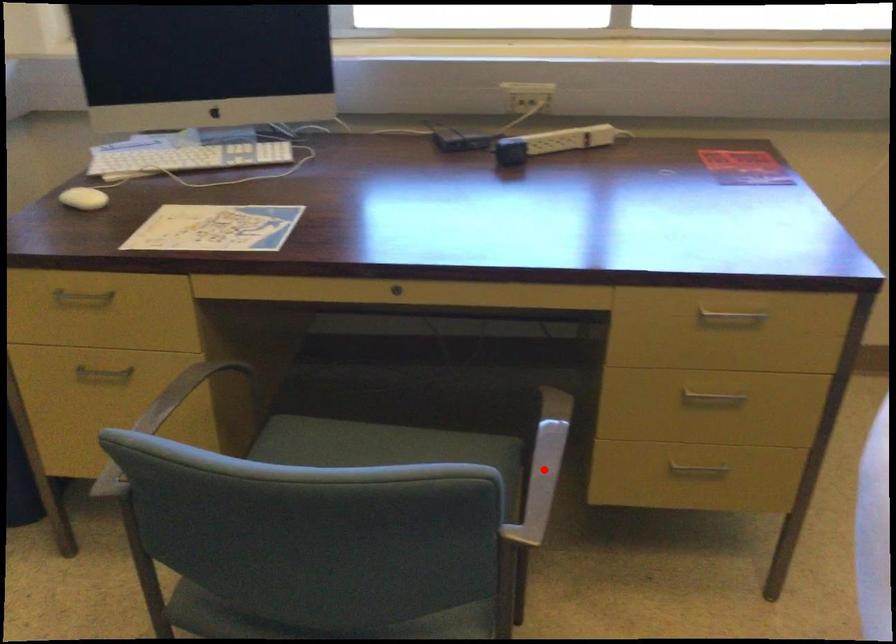
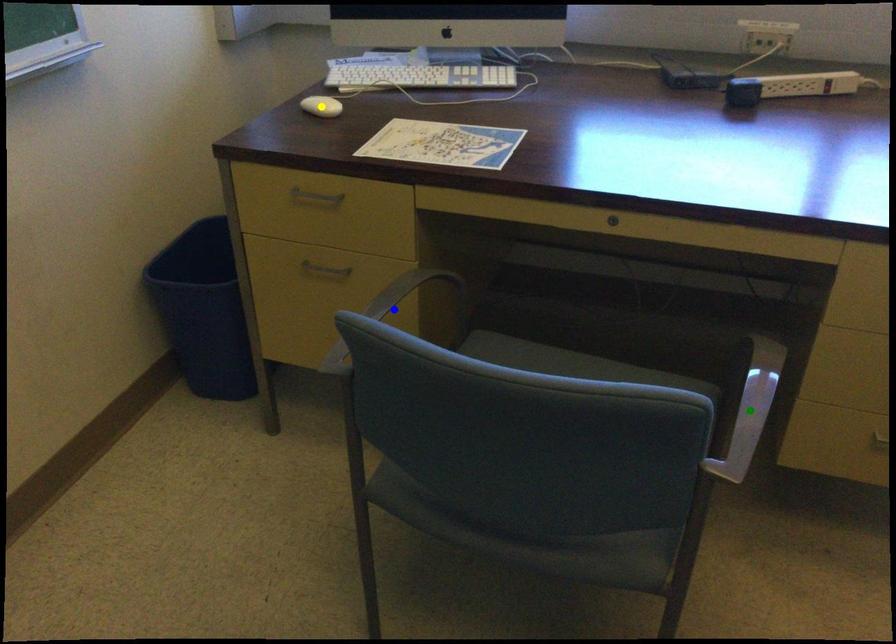
Question: I am providing you with two images of the same scene from different viewpoints. A red point is marked on the first image. You are given multiple points on the second image. Which spot in image 2 lines up with the point in image 1?

Choices:
 (A) yellow point
 (B) green point
 (C) blue point

Answer: (B)